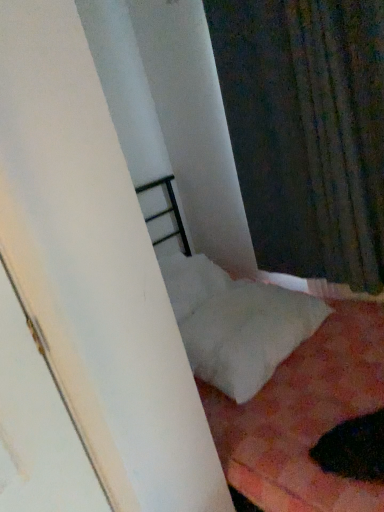
Describe the element at coordinates (307, 131) in the screenshot. The image size is (384, 512). I see `dark textured fabric at upper right` at that location.

What are the coordinates of `white soft bed at lower right` in the screenshot? It's located at (167, 212).

Where is `white soft pillow at lower right`? Image resolution: width=384 pixels, height=512 pixels. white soft pillow at lower right is located at coordinates (248, 334).

In order to face white soft pillow at lower right, should I rotate leftwards or rightwards?

It's best to rotate right around 6.432 degrees.

The height and width of the screenshot is (512, 384). I want to click on dark textured fabric at upper right, so click(x=307, y=131).

How distant is dark textured fabric at upper right from white soft pillow at lower right?

A distance of 22.79 inches exists between dark textured fabric at upper right and white soft pillow at lower right.

Considering the relative positions of dark textured fabric at upper right and white soft pillow at lower right in the image provided, is dark textured fabric at upper right to the left of white soft pillow at lower right from the viewer's perspective?

No.

From a real-world perspective, is dark textured fabric at upper right physically below white soft pillow at lower right?

No.

Where is `curtain lying on the right of white soft pillow at lower right`? The height and width of the screenshot is (512, 384). curtain lying on the right of white soft pillow at lower right is located at coordinates (307, 131).

Does dark textured fabric at upper right appear on the left side of white soft bed at lower right?

Incorrect, dark textured fabric at upper right is not on the left side of white soft bed at lower right.

Is point (249, 161) closer or farther from the camera than point (179, 222)?

Point (249, 161) appears to be closer to the viewer than point (179, 222).

Is dark textured fabric at upper right located outside white soft bed at lower right?

No, dark textured fabric at upper right is not outside of white soft bed at lower right.

From a real-world perspective, is white soft bed at lower right physically below white soft pillow at lower right?

Yes, from a real-world perspective, white soft bed at lower right is below white soft pillow at lower right.

Is white soft pillow at lower right at the back of white soft bed at lower right?

Yes.

Is white soft bed at lower right placed right next to white soft pillow at lower right?

No, white soft bed at lower right is not making contact with white soft pillow at lower right.

The height and width of the screenshot is (512, 384). I want to click on pillow behind the white soft bed at lower right, so click(248, 334).

Does white soft pillow at lower right turn towards white soft bed at lower right?

Yes, white soft pillow at lower right is aimed at white soft bed at lower right.

This screenshot has height=512, width=384. Find the location of `pillow behind the white soft bed at lower right`. pillow behind the white soft bed at lower right is located at coordinates (248, 334).

Considering the relative sizes of white soft pillow at lower right and white soft bed at lower right in the image provided, is white soft pillow at lower right wider than white soft bed at lower right?

No, white soft pillow at lower right is not wider than white soft bed at lower right.

How many degrees apart are the facing directions of white soft bed at lower right and dark textured fabric at upper right?

89.6 degrees.

Identify the location of bed on the left of dark textured fabric at upper right. Image resolution: width=384 pixels, height=512 pixels. (167, 212).

Is white soft bed at lower right located outside dark textured fabric at upper right?

Yes, white soft bed at lower right is not within dark textured fabric at upper right.

From the image's perspective, between white soft pillow at lower right and dark textured fabric at upper right, which one is located above?

dark textured fabric at upper right, from the image's perspective.

Can we say white soft pillow at lower right lies outside dark textured fabric at upper right?

Absolutely, white soft pillow at lower right is external to dark textured fabric at upper right.

Considering the sizes of white soft pillow at lower right and dark textured fabric at upper right in the image, is white soft pillow at lower right wider or thinner than dark textured fabric at upper right?

In the image, white soft pillow at lower right appears to be wider than dark textured fabric at upper right.

Does point (266, 346) come behind point (372, 263)?

That is False.

Identify the location of curtain on the right of white soft pillow at lower right. Image resolution: width=384 pixels, height=512 pixels. (307, 131).

Image resolution: width=384 pixels, height=512 pixels. In order to click on bed on the left of dark textured fabric at upper right in this screenshot , I will do [x=167, y=212].

Considering their positions, is white soft bed at lower right positioned closer to dark textured fabric at upper right than white soft pillow at lower right?

white soft pillow at lower right is positioned closer to the anchor dark textured fabric at upper right.

Estimate the real-world distances between objects in this image. Which object is closer to white soft pillow at lower right, dark textured fabric at upper right or white soft bed at lower right?

dark textured fabric at upper right is positioned closer to the anchor white soft pillow at lower right.

When comparing their distances from white soft bed at lower right, does dark textured fabric at upper right or white soft pillow at lower right seem further?

Among the two, white soft pillow at lower right is located further to white soft bed at lower right.

Looking at the image, which one is located further to white soft bed at lower right, white soft pillow at lower right or dark textured fabric at upper right?

white soft pillow at lower right lies further to white soft bed at lower right than the other object.

Consider the image. From the image, which object appears to be nearer to white soft pillow at lower right, white soft bed at lower right or dark textured fabric at upper right?

dark textured fabric at upper right.

Estimate the real-world distances between objects in this image. Which object is closer to dark textured fabric at upper right, white soft pillow at lower right or white soft bed at lower right?

Based on the image, white soft pillow at lower right appears to be nearer to dark textured fabric at upper right.

Find the location of `bed between dark textured fabric at upper right and white soft pillow at lower right from top to bottom`. bed between dark textured fabric at upper right and white soft pillow at lower right from top to bottom is located at coordinates (167, 212).